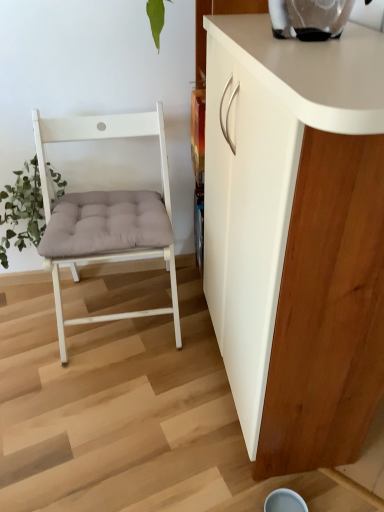
Question: Is point pyautogui.click(x=77, y=251) closer or farther from the camera than point pyautogui.click(x=352, y=428)?

Choices:
 (A) closer
 (B) farther

Answer: (B)

Question: Based on their positions, is white wood chair at left located to the left or right of white matte cabinet at right?

Choices:
 (A) left
 (B) right

Answer: (A)

Question: Which is nearer to the green fuzzy plant at left?

Choices:
 (A) white wood chair at left
 (B) white matte cabinet at right

Answer: (A)

Question: Estimate the real-world distances between objects in this image. Which object is closer to the white matte cabinet at right?

Choices:
 (A) green fuzzy plant at left
 (B) white wood chair at left

Answer: (B)